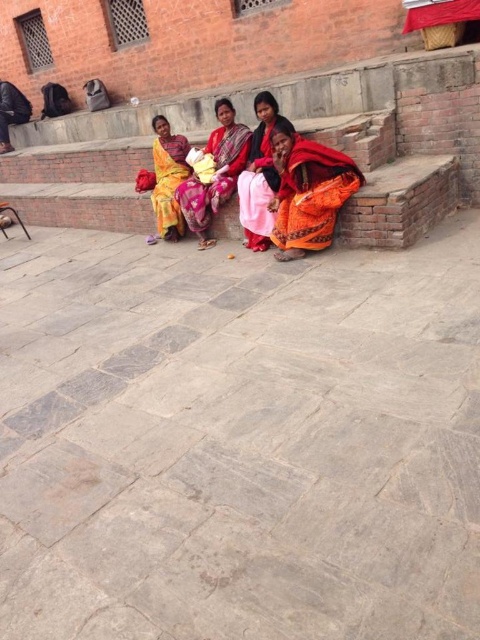
Question: Estimate the real-world distances between objects in this image. Which object is closer to the matte black bag at left?

Choices:
 (A) orange fabric at center
 (B) orange fabric sari at lower right
 (C) matte yellow sari at left
 (D) orange fabric sari at center

Answer: (C)

Question: Is orange fabric sari at center to the right of orange fabric at center from the viewer's perspective?

Choices:
 (A) yes
 (B) no

Answer: (B)

Question: Considering the relative positions of orange fabric sari at center and matte black bag at left in the image provided, where is orange fabric sari at center located with respect to matte black bag at left?

Choices:
 (A) below
 (B) above

Answer: (A)

Question: Does orange fabric sari at lower right appear on the right side of orange fabric at center?

Choices:
 (A) no
 (B) yes

Answer: (B)

Question: Among these objects, which one is nearest to the camera?

Choices:
 (A) orange fabric sari at lower right
 (B) matte black bag at left
 (C) orange fabric sari at center
 (D) matte yellow sari at left

Answer: (A)

Question: Which is nearer to the orange fabric sari at center?

Choices:
 (A) matte black bag at left
 (B) orange fabric at center

Answer: (B)